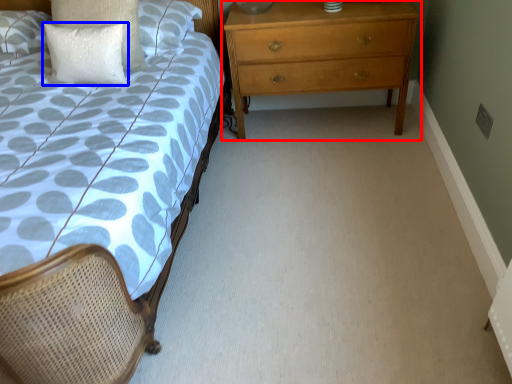
Question: Which object appears farthest to the camera in this image, chest of drawers (highlighted by a red box) or pillow (highlighted by a blue box)?

Choices:
 (A) chest of drawers
 (B) pillow

Answer: (A)